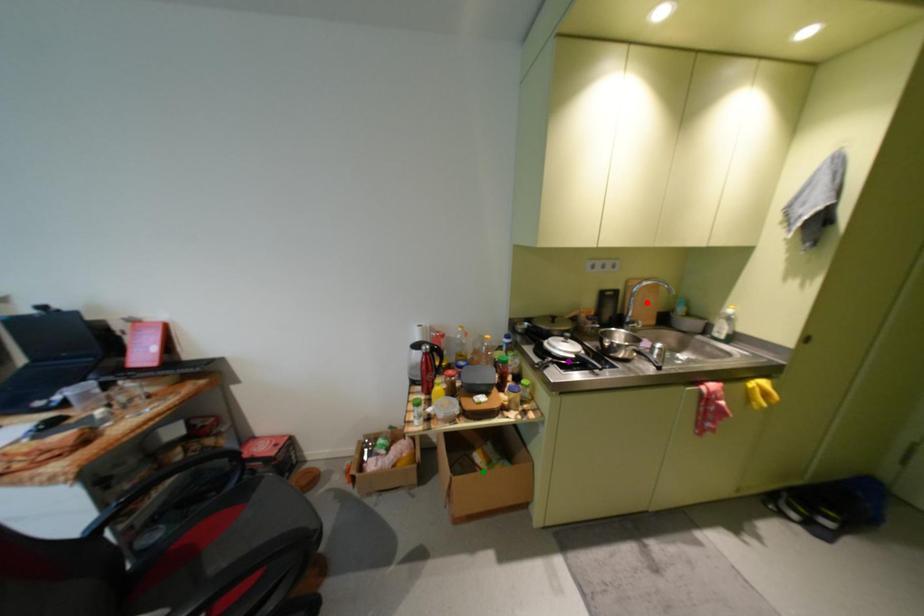
Looking at this image, order these from nearest to farthest:
purple point, green point, red point

green point
purple point
red point